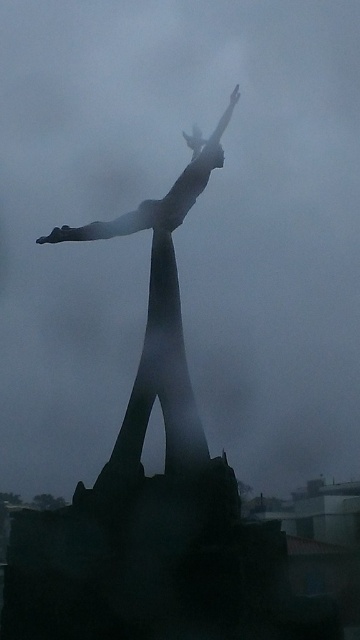
You are an art student analyzing the sculpture. You notice the bronze statue at center and the satin silver arm at center. Which part of the sculpture is narrower in width?

The bronze statue at center is narrower in width compared to the satin silver arm at center.